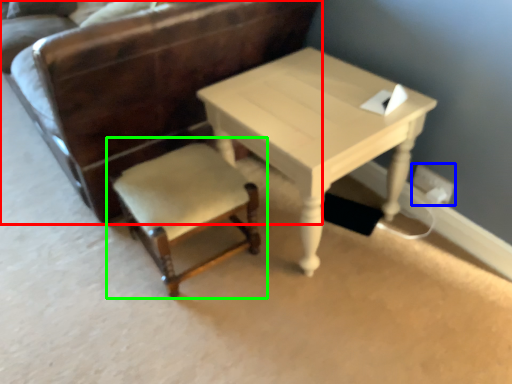
Question: Based on their relative distances, which object is farther from chair (highlighted by a red box)? Choose from electric outlet (highlighted by a blue box) and chair (highlighted by a green box).

Choices:
 (A) electric outlet
 (B) chair

Answer: (A)